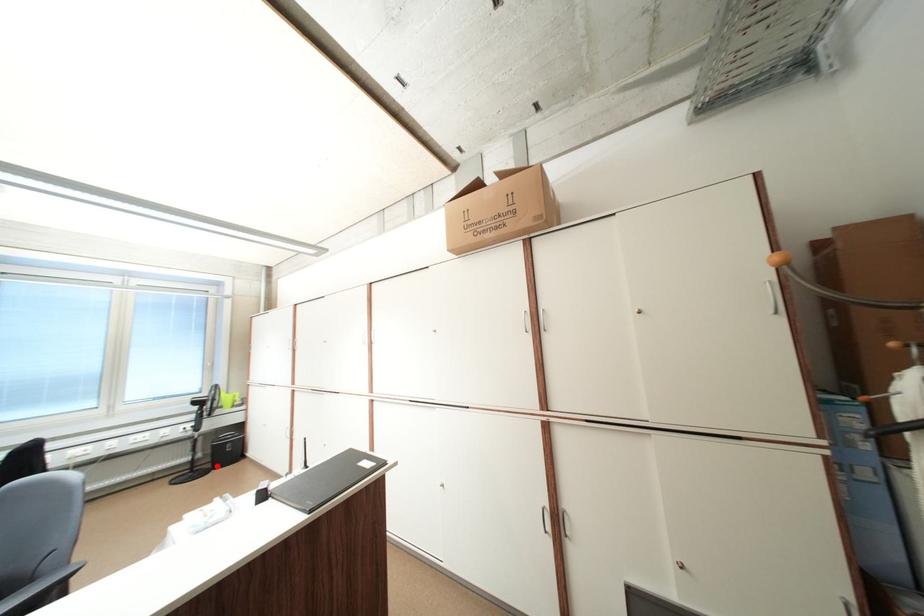
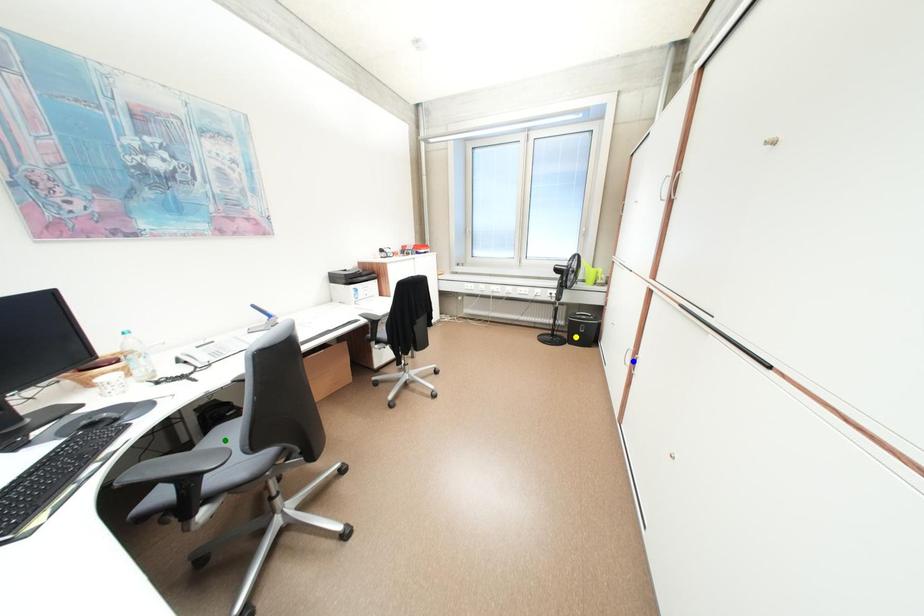
Question: I am providing you with two images of the same scene from different viewpoints. A red point is marked on the first image. You are given multiple points on the second image. Which point in image 2 represents the same 3d spot as the red point in image 1?

Choices:
 (A) blue point
 (B) green point
 (C) yellow point

Answer: (C)